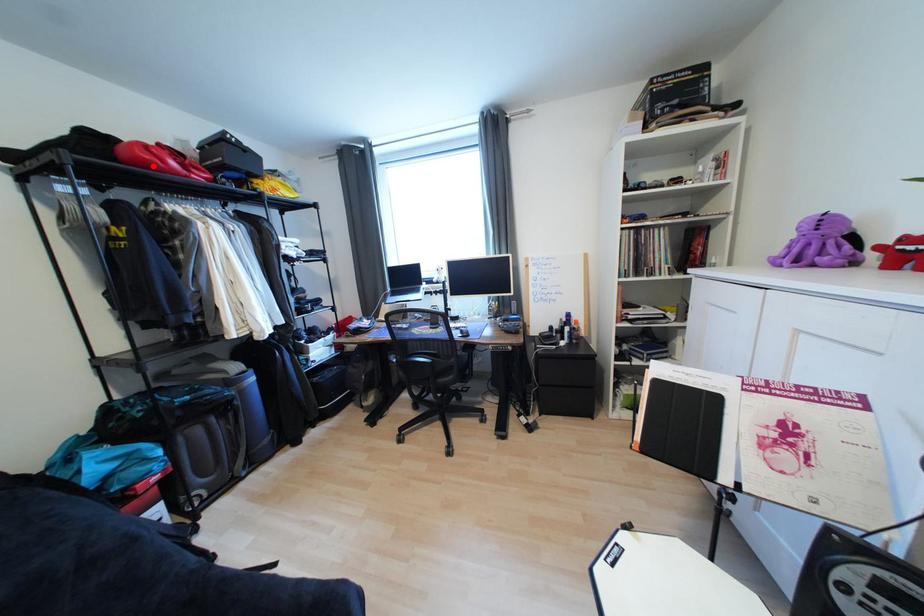
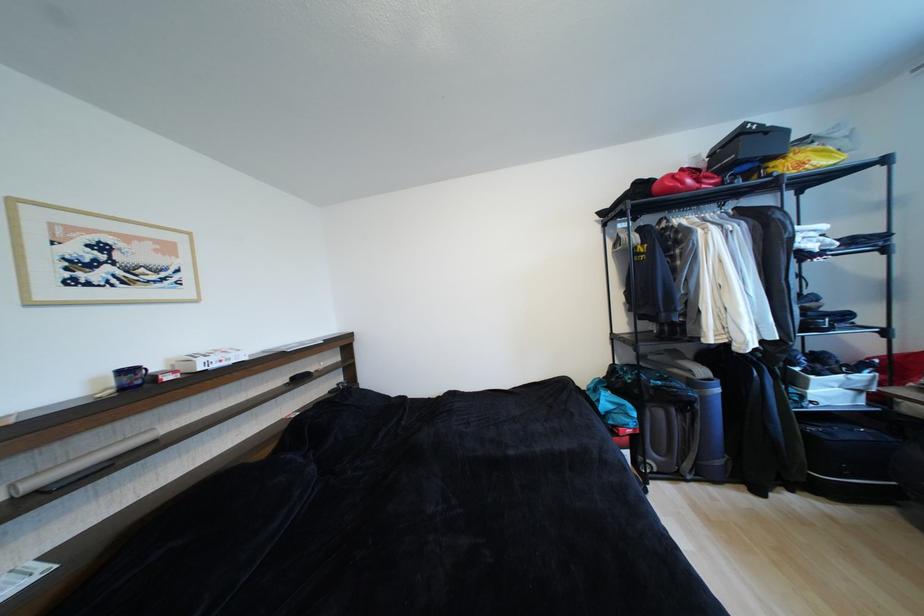
Locate, in the second image, the point that corresponds to the highlighted location in the first image.

(676, 192)